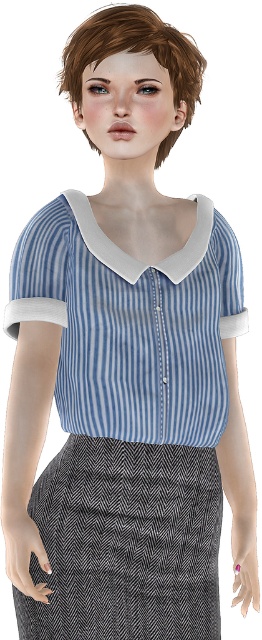
Question: In this image, where is blue striped shirt at center located relative to herringbone wool skirt at lower center?

Choices:
 (A) right
 (B) left

Answer: (A)

Question: Which point is closer to the camera?

Choices:
 (A) brown matte hair at upper center
 (B) blue striped shirt at center

Answer: (A)

Question: Is the position of blue striped shirt at center more distant than that of herringbone wool skirt at lower center?

Choices:
 (A) no
 (B) yes

Answer: (A)

Question: Which object appears farthest from the camera in this image?

Choices:
 (A) herringbone wool skirt at lower center
 (B) blue striped shirt at center
 (C) brown matte hair at upper center

Answer: (A)

Question: Does herringbone wool skirt at lower center appear under brown matte hair at upper center?

Choices:
 (A) no
 (B) yes

Answer: (B)

Question: Estimate the real-world distances between objects in this image. Which object is closer to the brown matte hair at upper center?

Choices:
 (A) blue striped shirt at center
 (B) herringbone wool skirt at lower center

Answer: (A)